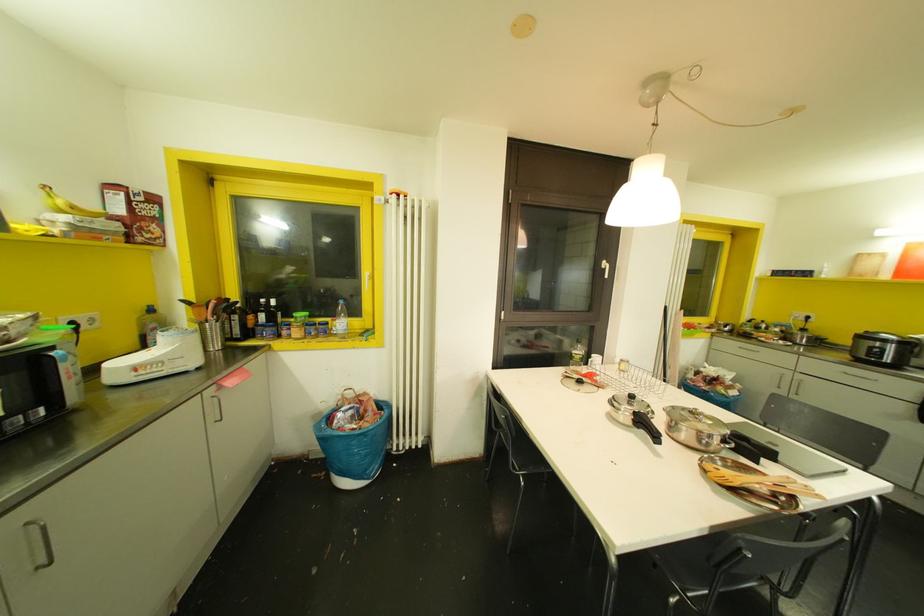
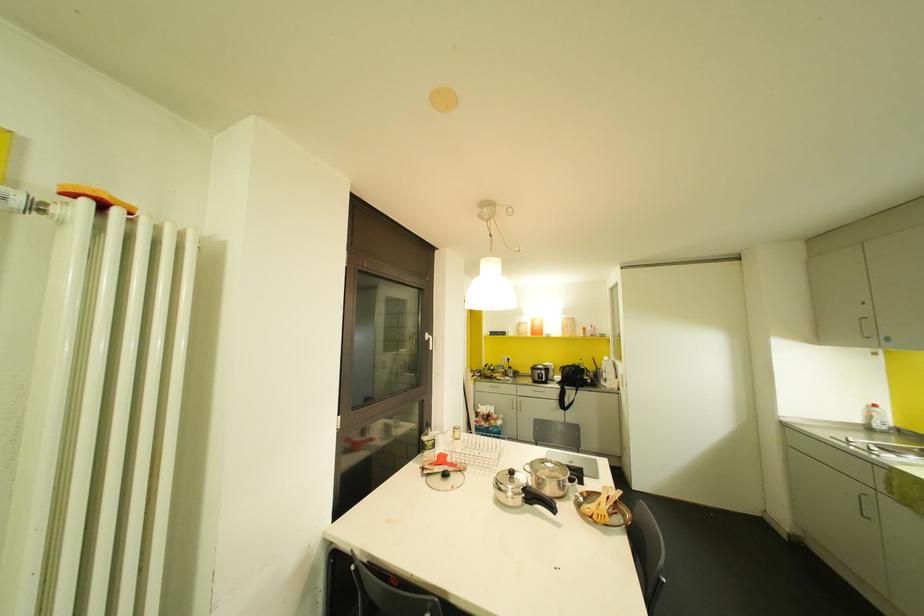
Find the pixel in the second image that matches (630,395) in the first image.

(511, 472)